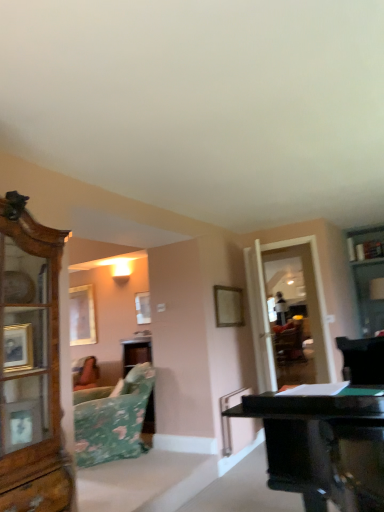
Question: Is floral fabric couch at lower left taller or shorter than wooden picture frame at center, marked as the 2th picture frame in a back-to-front arrangement?

Choices:
 (A) tall
 (B) short

Answer: (A)

Question: In terms of size, does floral fabric couch at lower left appear bigger or smaller than wooden picture frame at center, placed as the 2th picture frame when sorted from left to right?

Choices:
 (A) small
 (B) big

Answer: (B)

Question: Which object is the farthest from the floral fabric couch at lower left?

Choices:
 (A) wooden picture frame at center, the first picture frame positioned from the front
 (B) transparent glass door at right
 (C) wooden picture frame at upper left, arranged as the 2th picture frame when viewed from the right

Answer: (C)

Question: Which object is the farthest from the transparent glass door at right?

Choices:
 (A) floral fabric couch at lower left
 (B) wooden picture frame at center, placed as the 2th picture frame when sorted from left to right
 (C) wooden picture frame at upper left, the 2th picture frame positioned from the front

Answer: (C)